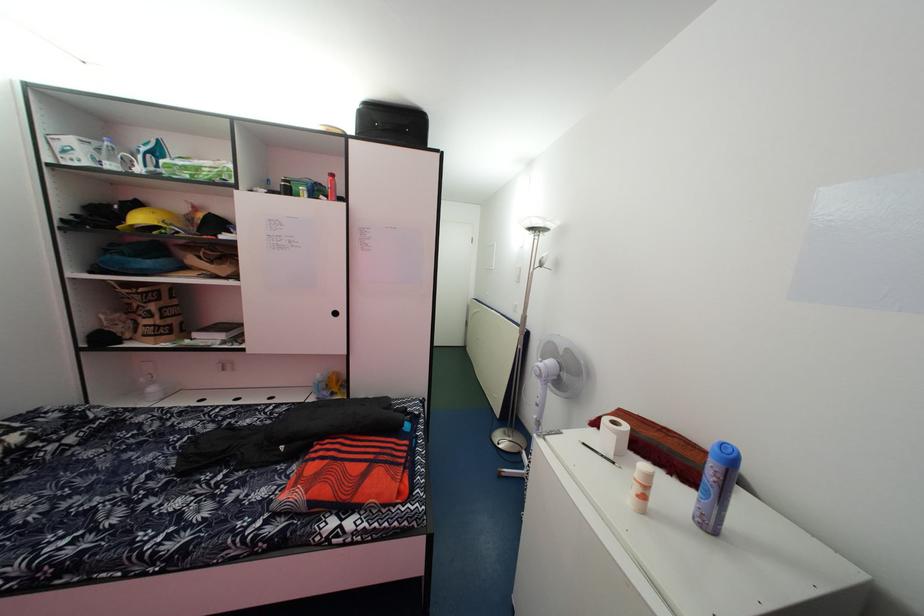
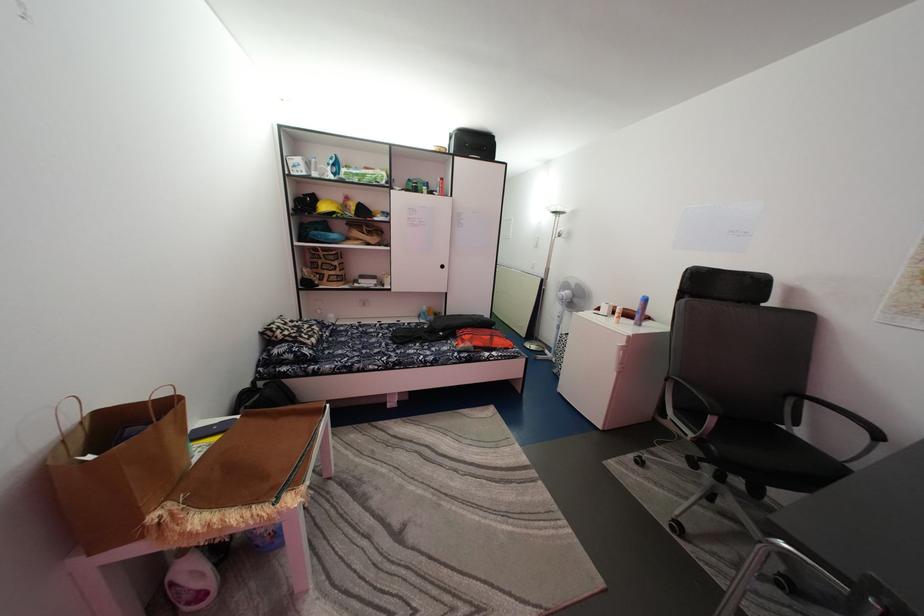
Find the pixel in the second image that matches point 367,111 in the first image.

(462, 137)